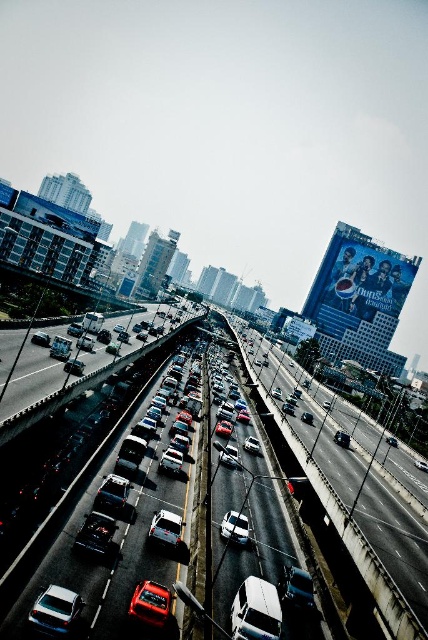
You are a traffic officer observing the highway. You notice two vehicles, a white glossy car at center and a white glossy sedan at center. Which one appears bigger in the scene?

The white glossy car at center is larger in size than the white glossy sedan at center, so the white glossy car at center appears bigger.

You are a drone operator trying to capture a photo of two specific points in the urban highway scene. The first point is at coordinates point (383, 609) and the second is at point (175, 516). Since you want the photo to clearly show both points, which point should you focus on to ensure the closer one is in sharp focus?

Point (383, 609) is closer to the camera than point (175, 516), so you should focus on point (383, 609) to ensure it is in sharp focus.

You are driving a metallic silver car at center and want to exit the highway. There is an exit ramp ahead that requires moving to the right lane. Can you safely move to the right lane without cutting off the white matte car at center?

The metallic silver car at center is in front of the white matte car at center, so you can safely move to the right lane without cutting off the white matte car at center as long as there is enough space to maneuver around it.